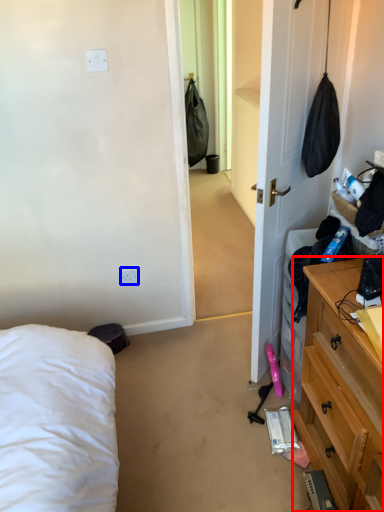
Question: Which of the following is the closest to the observer, cabinetry (highlighted by a red box) or electric outlet (highlighted by a blue box)?

Choices:
 (A) cabinetry
 (B) electric outlet

Answer: (A)